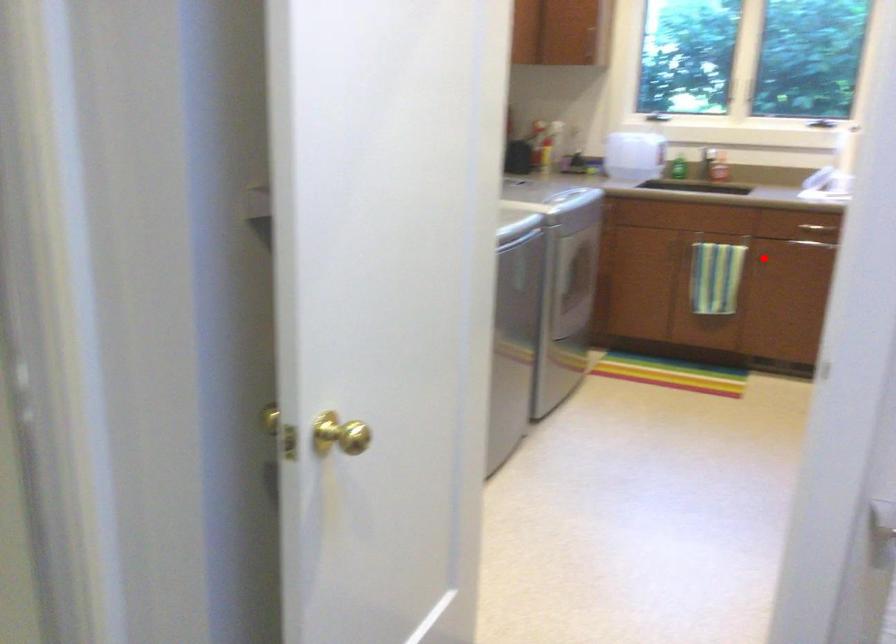
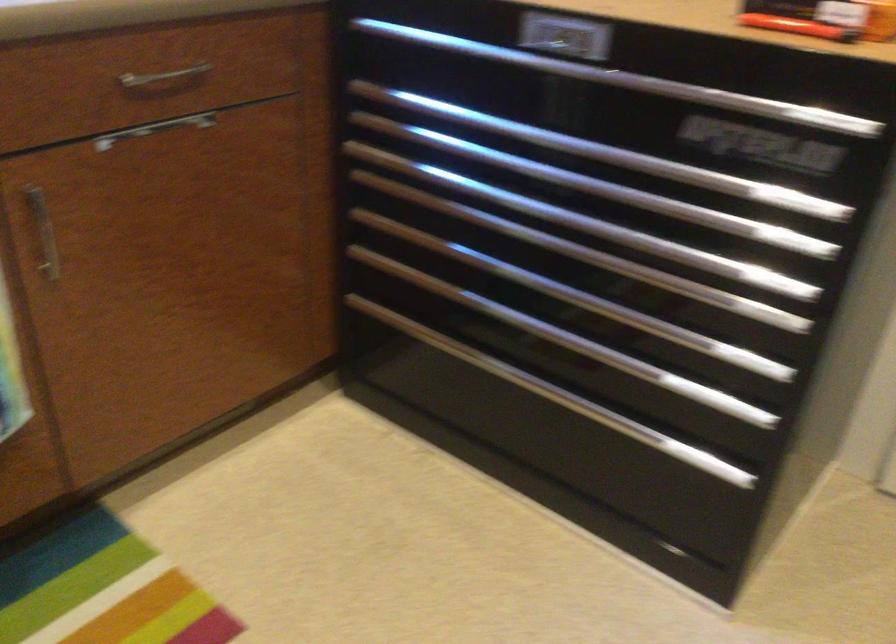
Locate, in the second image, the point that corresponds to the highlighted location in the first image.

(42, 232)